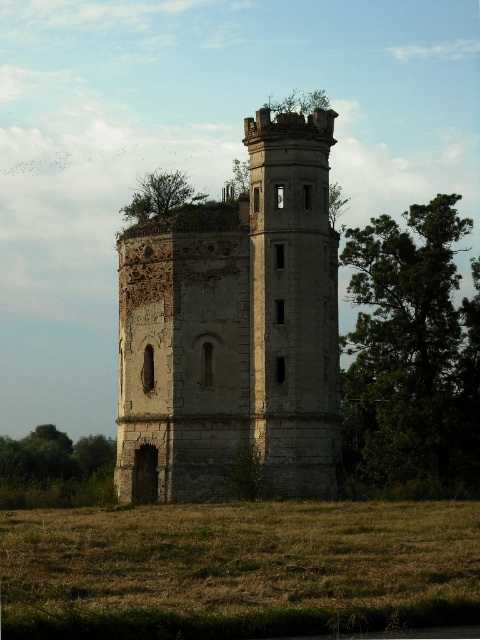
You are standing at the base of the old tower and notice a point marked at coordinates (238,570). According to the image, what is located at this point?

The point at coordinates (238,570) indicates brown grass at lower center.